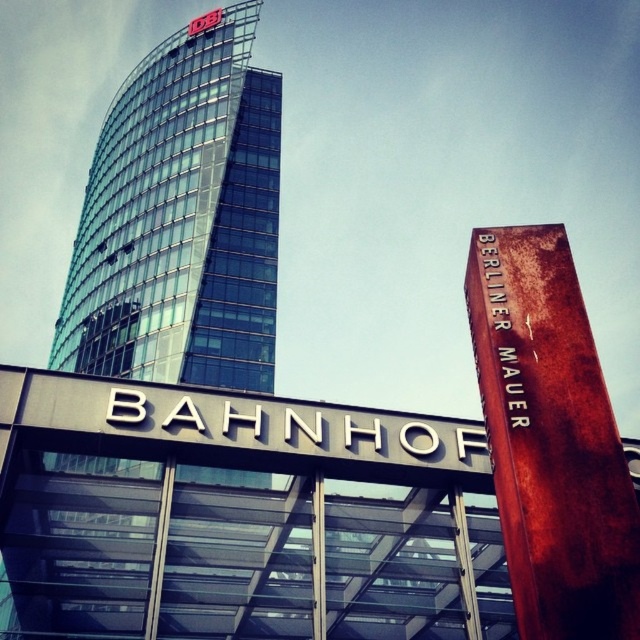
Is point (275, 148) in front of point (582, 563)?

That is False.

Between glassy steel skyscraper at upper left and rusty metal berliner mauer at right, which one has less height?

Standing shorter between the two is rusty metal berliner mauer at right.

Who is more forward, (177, 364) or (620, 624)?

Point (620, 624) is more forward.

This screenshot has width=640, height=640. In order to click on glassy steel skyscraper at upper left in this screenshot , I will do `click(180, 218)`.